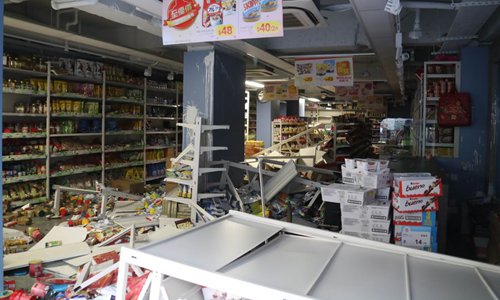
The height and width of the screenshot is (300, 500). In order to click on signage hanging from ceiling in this screenshot , I will do `click(319, 76)`, `click(338, 76)`.